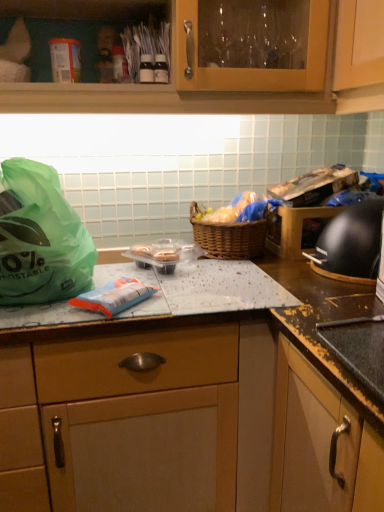
The image size is (384, 512). I want to click on brown woven basket at center, so click(237, 210).

In order to face black granite countertop at center, should I rotate leftwards or rightwards?

To align with it, rotate right about 1.054°.

What is the approximate height of woven brown picnic basket at center?

It is 6.83 inches.

Locate an element on the screen. The height and width of the screenshot is (512, 384). green plastic bag at left is located at coordinates (40, 238).

In the scene shown: What is the approximate width of green plastic bag at left?

12.23 inches.

You are a GUI agent. You are given a task and a screenshot of the screen. Output one action in this format:
    pyautogui.click(x=<x>, y=<y>)
    Task: Click on the brown woven basket at center
    
    Given the screenshot: What is the action you would take?
    pyautogui.click(x=237, y=210)

From a real-world perspective, which object stands above the other?

green plastic bag at left.

In the scene shown: Which object is thinner, green plastic bag at left or brown woven basket at center?

brown woven basket at center.

Which is in front, green plastic bag at left or brown woven basket at center?

green plastic bag at left is more forward.

Are green plastic bag at left and woven brown picnic basket at center beside each other?

No, green plastic bag at left is not with woven brown picnic basket at center.

From a real-world perspective, is green plastic bag at left positioned above or below woven brown picnic basket at center?

From a real-world perspective, green plastic bag at left is physically above woven brown picnic basket at center.

Does green plastic bag at left lie behind woven brown picnic basket at center?

No, green plastic bag at left is closer to the viewer.

How many degrees apart are the facing directions of brown woven basket at center and white cardboard canister at upper left?

The facing directions of brown woven basket at center and white cardboard canister at upper left are 3.47 degrees apart.

Can you confirm if brown woven basket at center is positioned to the right of white cardboard canister at upper left?

Yes.

Considering the positions of points (262, 204) and (80, 62), is point (262, 204) farther from camera compared to point (80, 62)?

Yes.

Locate an element on the screen. food behind the white cardboard canister at upper left is located at coordinates (237, 210).

Between point (367, 210) and point (236, 212), which one is positioned in front?

The point (367, 210) is closer to the camera.

How different are the orientations of black matte gas stove at right and brown woven basket at center in degrees?

The facing directions of black matte gas stove at right and brown woven basket at center are 89.3 degrees apart.

I want to click on food lying on the left of black matte gas stove at right, so 237,210.

Is point (381, 221) closer or farther from the camera than point (204, 227)?

Point (381, 221).

Does black matte gas stove at right have a smaller size compared to woven brown picnic basket at center?

No.

You are a GUI agent. You are given a task and a screenshot of the screen. Output one action in this format:
    pyautogui.click(x=<x>, y=<y>)
    Task: Click on the gas stove that appears in front of the woven brown picnic basket at center
    Image resolution: width=384 pixels, height=512 pixels.
    Given the screenshot: What is the action you would take?
    pyautogui.click(x=351, y=244)

Does green plastic bag at left appear on the left side of white cardboard canister at upper left?

Indeed, green plastic bag at left is positioned on the left side of white cardboard canister at upper left.

Is green plastic bag at left inside the boundaries of white cardboard canister at upper left, or outside?

green plastic bag at left cannot be found inside white cardboard canister at upper left.

How different are the orientations of green plastic bag at left and white cardboard canister at upper left in degrees?

2.1 degrees.

Does black matte gas stove at right turn towards white cardboard canister at upper left?

No, black matte gas stove at right is not oriented towards white cardboard canister at upper left.

Is black matte gas stove at right positioned behind white cardboard canister at upper left?

No, black matte gas stove at right is closer to the camera.

Is black matte gas stove at right taller than white cardboard canister at upper left?

Indeed, black matte gas stove at right has a greater height compared to white cardboard canister at upper left.

Between black matte gas stove at right and white cardboard canister at upper left, which one appears on the left side from the viewer's perspective?

Positioned to the left is white cardboard canister at upper left.

Find the location of a particular element. food that appears below the green plastic bag at left (from a real-world perspective) is located at coordinates (237, 210).

The image size is (384, 512). Identify the location of plastic bag below the woven brown picnic basket at center (from the image's perspective). (40, 238).

In the scene shown: When comparing their distances from black matte gas stove at right, does white cardboard canister at upper left or brown woven basket at center seem closer?

The object closer to black matte gas stove at right is brown woven basket at center.

Estimate the real-world distances between objects in this image. Which object is closer to brown woven basket at center, black granite countertop at center or green plastic bag at left?

black granite countertop at center is positioned closer to the anchor brown woven basket at center.

When comparing their distances from black granite countertop at center, does green plastic bag at left or white cardboard canister at upper left seem closer?

The object closer to black granite countertop at center is green plastic bag at left.

Based on their spatial positions, is black matte gas stove at right or woven brown picnic basket at center closer to green plastic bag at left?

woven brown picnic basket at center is closer to green plastic bag at left.

Which object lies further to the anchor point woven brown picnic basket at center, brown woven basket at center or black granite countertop at center?

black granite countertop at center is positioned further to the anchor woven brown picnic basket at center.

Looking at the image, which one is located further to brown woven basket at center, black matte gas stove at right or woven brown picnic basket at center?

black matte gas stove at right.

From the image, which object appears to be farther from white cardboard canister at upper left, black matte gas stove at right or black granite countertop at center?

black matte gas stove at right.

When comparing their distances from white cardboard canister at upper left, does green plastic bag at left or black granite countertop at center seem further?

The object further to white cardboard canister at upper left is black granite countertop at center.

Identify the location of gas stove that lies between white cardboard canister at upper left and black granite countertop at center from top to bottom. (351, 244).

At what (x,y) coordinates should I click in order to perform the action: click on kitchen appliance between green plastic bag at left and brown woven basket at center from left to right. Please return your answer as a coordinate pair (x, y). Looking at the image, I should click on (65, 60).

Find the location of a particular element. This screenshot has width=384, height=512. picnic basket between green plastic bag at left and brown woven basket at center is located at coordinates (228, 237).

The height and width of the screenshot is (512, 384). I want to click on picnic basket located between white cardboard canister at upper left and black matte gas stove at right in the left-right direction, so click(228, 237).